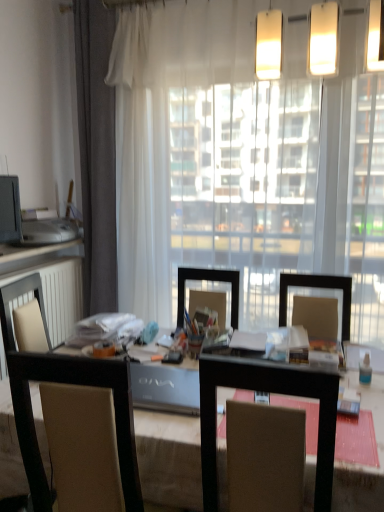
Question: Does brown fabric chair at center have a lesser height compared to transparent curtain at center?

Choices:
 (A) no
 (B) yes

Answer: (B)

Question: Is brown fabric chair at center turned away from transparent curtain at center?

Choices:
 (A) no
 (B) yes

Answer: (B)

Question: Is brown fabric chair at center at the left side of transparent curtain at center?

Choices:
 (A) no
 (B) yes

Answer: (B)

Question: Does brown fabric chair at center have a greater width compared to transparent curtain at center?

Choices:
 (A) yes
 (B) no

Answer: (A)

Question: Considering the relative sizes of brown fabric chair at center and transparent curtain at center in the image provided, is brown fabric chair at center smaller than transparent curtain at center?

Choices:
 (A) yes
 (B) no

Answer: (A)

Question: Is brown fabric chair at center inside the boundaries of matte white countertop at left, or outside?

Choices:
 (A) outside
 (B) inside

Answer: (A)

Question: Is brown fabric chair at center to the left or to the right of matte white countertop at left in the image?

Choices:
 (A) left
 (B) right

Answer: (B)

Question: From a real-world perspective, relative to matte white countertop at left, is brown fabric chair at center vertically above or below?

Choices:
 (A) above
 (B) below

Answer: (B)

Question: Considering the positions of brown fabric chair at center and matte white countertop at left in the image, is brown fabric chair at center bigger or smaller than matte white countertop at left?

Choices:
 (A) small
 (B) big

Answer: (B)

Question: Would you say gray fabric curtain at left is to the left or to the right of wooden table at center in the picture?

Choices:
 (A) right
 (B) left

Answer: (B)

Question: From the image's perspective, is gray fabric curtain at left above or below wooden table at center?

Choices:
 (A) below
 (B) above

Answer: (B)

Question: Considering their positions, is gray fabric curtain at left located in front of or behind wooden table at center?

Choices:
 (A) behind
 (B) front

Answer: (A)

Question: Do you think gray fabric curtain at left is within wooden table at center, or outside of it?

Choices:
 (A) inside
 (B) outside

Answer: (B)

Question: From the image's perspective, relative to gray fabric curtain at left, is matte white countertop at left above or below?

Choices:
 (A) above
 (B) below

Answer: (B)

Question: Considering the positions of matte white countertop at left and gray fabric curtain at left in the image, is matte white countertop at left taller or shorter than gray fabric curtain at left?

Choices:
 (A) tall
 (B) short

Answer: (B)